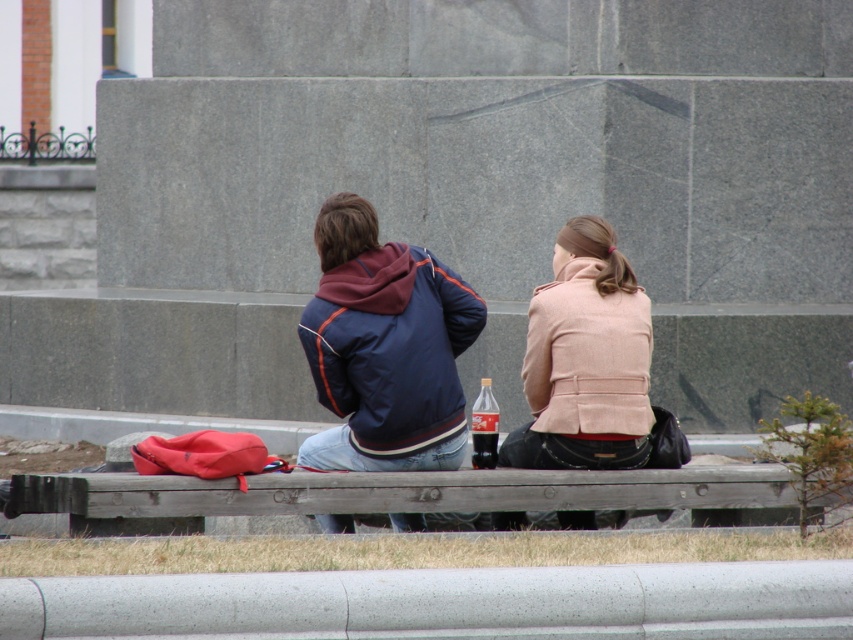
Question: Is the position of matte blue jacket at center less distant than that of beige woolen coat at center?

Choices:
 (A) no
 (B) yes

Answer: (B)

Question: Among these points, which one is farthest from the camera?

Choices:
 (A) (469, 490)
 (B) (535, 328)

Answer: (B)

Question: In this image, where is wooden bench at center located relative to translucent plastic soda can at center?

Choices:
 (A) below
 (B) above

Answer: (A)

Question: Among these points, which one is farthest from the camera?

Choices:
 (A) (643, 464)
 (B) (76, 477)
 (C) (482, 392)
 (D) (367, 250)

Answer: (C)

Question: Among these objects, which one is nearest to the camera?

Choices:
 (A) translucent plastic soda can at center
 (B) beige woolen coat at center
 (C) matte blue jacket at center
 (D) wooden bench at center

Answer: (D)

Question: Is wooden bench at center above beige woolen coat at center?

Choices:
 (A) yes
 (B) no

Answer: (B)